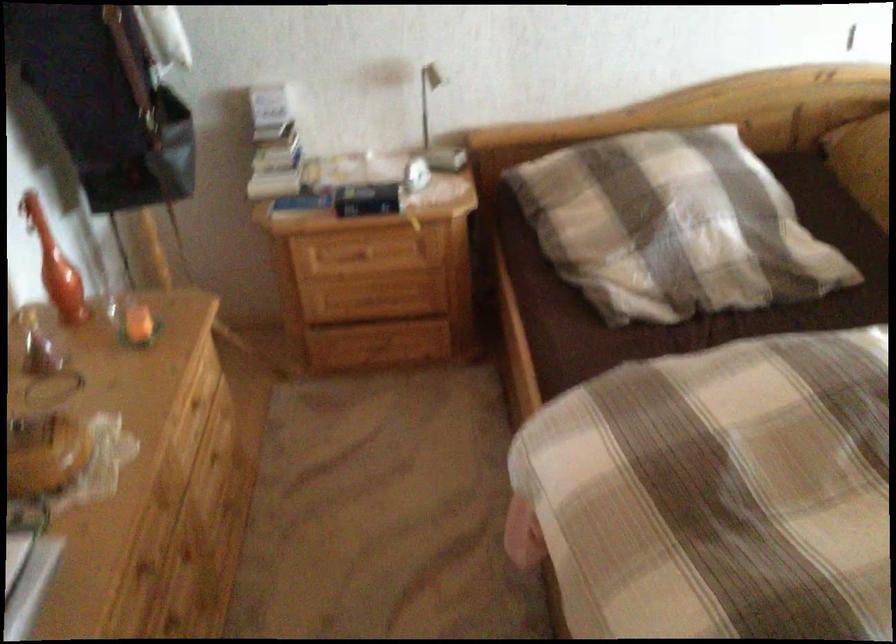
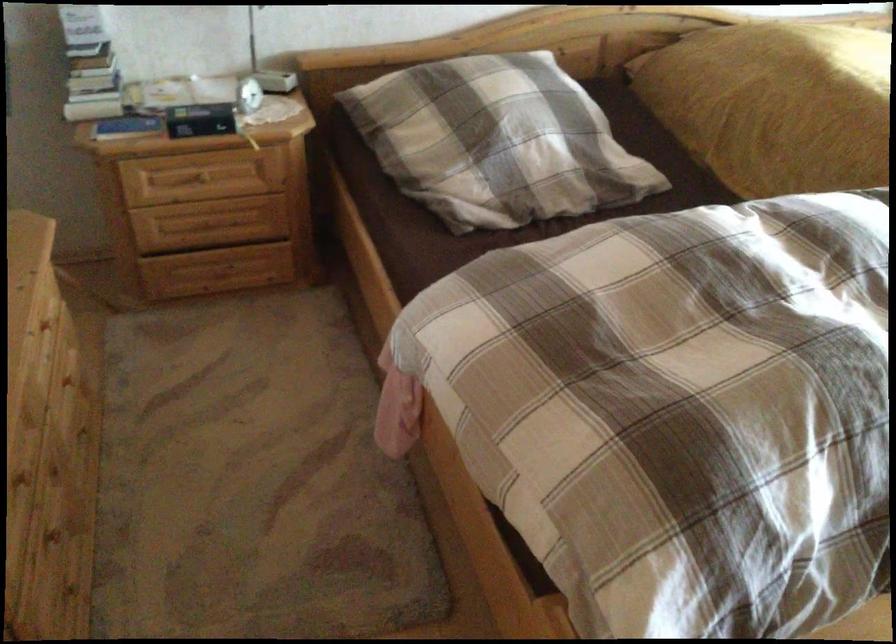
The images are taken continuously from a first-person perspective. In which direction are you moving?

The cameraman walked toward left, backward.